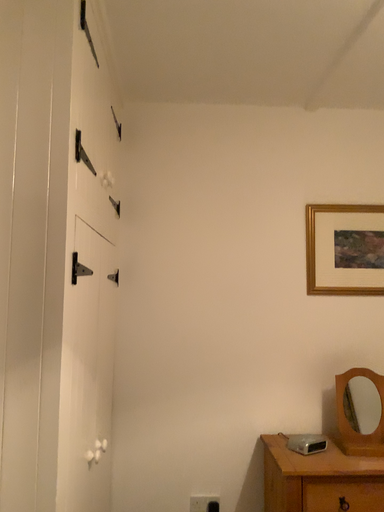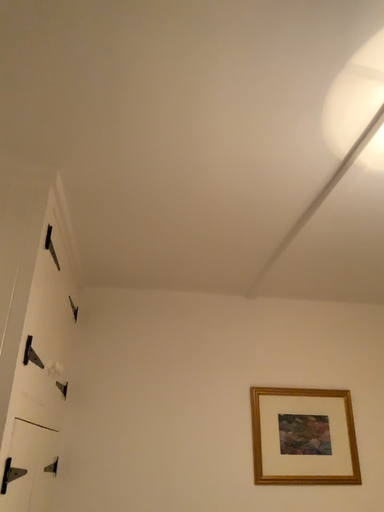
Question: Which way did the camera rotate in the video?

Choices:
 (A) rotated upward
 (B) rotated downward

Answer: (A)